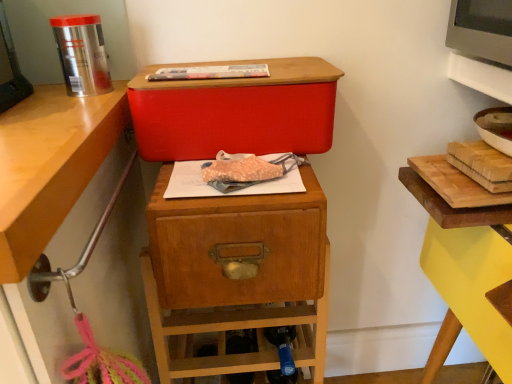
Question: Should I look upward or downward to see matte plastic baguette at center?

Choices:
 (A) down
 (B) up

Answer: (B)

Question: Is matte red storage box at center in front of matte plastic baguette at center?

Choices:
 (A) no
 (B) yes

Answer: (B)

Question: Is matte red storage box at center positioned far away from matte plastic baguette at center?

Choices:
 (A) no
 (B) yes

Answer: (A)

Question: Can you confirm if matte red storage box at center is taller than matte plastic baguette at center?

Choices:
 (A) yes
 (B) no

Answer: (A)

Question: Is matte red storage box at center to the right of matte plastic baguette at center from the viewer's perspective?

Choices:
 (A) no
 (B) yes

Answer: (B)

Question: Can you confirm if matte red storage box at center is thinner than matte plastic baguette at center?

Choices:
 (A) no
 (B) yes

Answer: (A)

Question: Can you confirm if matte red storage box at center is wider than matte plastic baguette at center?

Choices:
 (A) no
 (B) yes

Answer: (B)

Question: Does wooden drawer at center have a larger size compared to matte red storage box at center?

Choices:
 (A) yes
 (B) no

Answer: (A)

Question: Is wooden drawer at center facing away from matte red storage box at center?

Choices:
 (A) no
 (B) yes

Answer: (A)

Question: From a real-world perspective, is wooden drawer at center over matte red storage box at center?

Choices:
 (A) no
 (B) yes

Answer: (A)

Question: Would you say matte red storage box at center is part of wooden drawer at center's contents?

Choices:
 (A) no
 (B) yes

Answer: (A)

Question: Does wooden drawer at center appear on the left side of matte red storage box at center?

Choices:
 (A) no
 (B) yes

Answer: (B)

Question: Could you tell me if wooden drawer at center is facing matte red storage box at center?

Choices:
 (A) no
 (B) yes

Answer: (A)

Question: Is wooden drawer at center oriented away from matte plastic baguette at center?

Choices:
 (A) yes
 (B) no

Answer: (B)